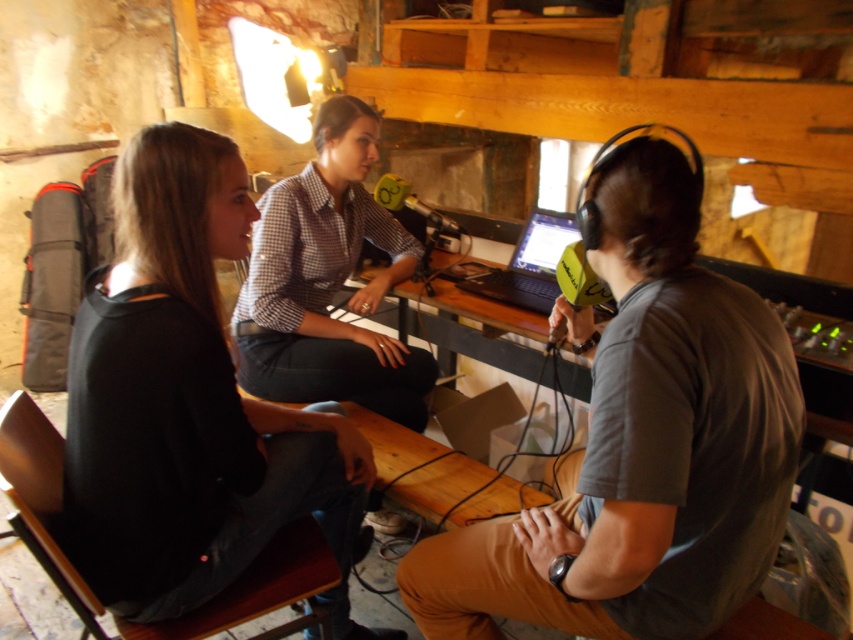
Which is in front, point (219, 488) or point (527, 225)?

Positioned in front is point (219, 488).

Can you confirm if black matte shirt at left is positioned below black matte laptop at center?

Yes, black matte shirt at left is below black matte laptop at center.

Does point (126, 282) lie behind point (570, 214)?

No, it is in front of (570, 214).

Identify the location of black matte shirt at left. (189, 404).

Is gray cotton shirt at right taller than black matte laptop at center?

Correct, gray cotton shirt at right is much taller as black matte laptop at center.

Can you confirm if gray cotton shirt at right is thinner than black matte laptop at center?

No.

Between point (730, 474) and point (534, 301), which one is positioned in front?

Positioned in front is point (730, 474).

This screenshot has width=853, height=640. In order to click on gray cotton shirt at right in this screenshot , I will do `click(641, 442)`.

Can you confirm if gray cotton shirt at right is taller than black matte shirt at left?

Incorrect, gray cotton shirt at right's height is not larger of black matte shirt at left's.

Is point (624, 355) closer to viewer compared to point (299, 435)?

Yes, point (624, 355) is closer to viewer.

In order to click on gray cotton shirt at right in this screenshot , I will do `click(641, 442)`.